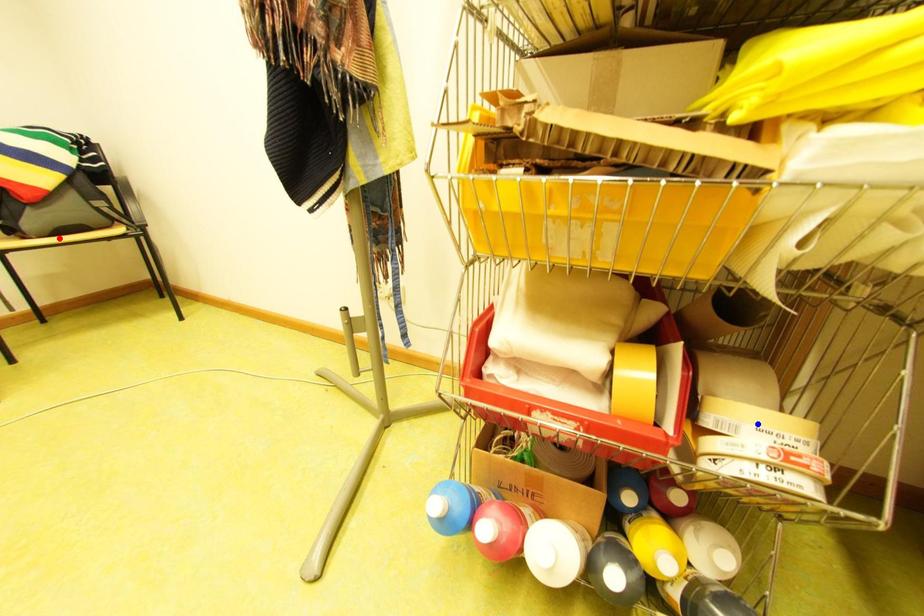
Question: In the image, two points are highlighted. Which point is nearer to the camera? Reply with the corresponding letter.

Choices:
 (A) blue point
 (B) red point

Answer: (A)